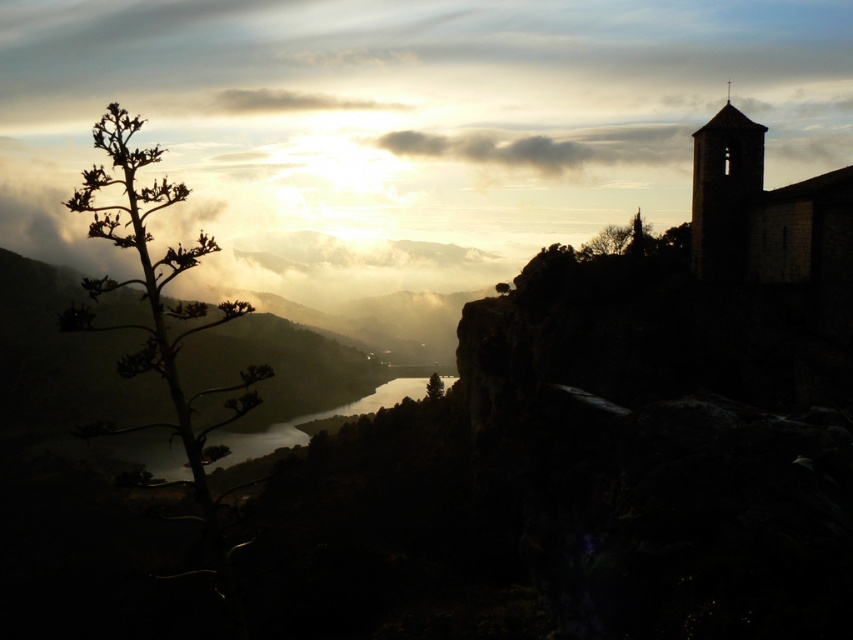
Based on the photo, which is below, silhouette leafy tree at left or white fluffy cloud at upper center?

silhouette leafy tree at left is lower down.

Is point (184, 420) closer to viewer compared to point (329, 104)?

Yes.

Identify the location of silhouette leafy tree at left. This screenshot has height=640, width=853. (154, 292).

Where is `silhouette leafy tree at left`? silhouette leafy tree at left is located at coordinates (154, 292).

Find the location of a particular element. dark stone tower at upper right is located at coordinates (724, 192).

Describe the element at coordinates (724, 192) in the screenshot. I see `dark stone tower at upper right` at that location.

The image size is (853, 640). In order to click on dark stone tower at upper right in this screenshot , I will do `click(724, 192)`.